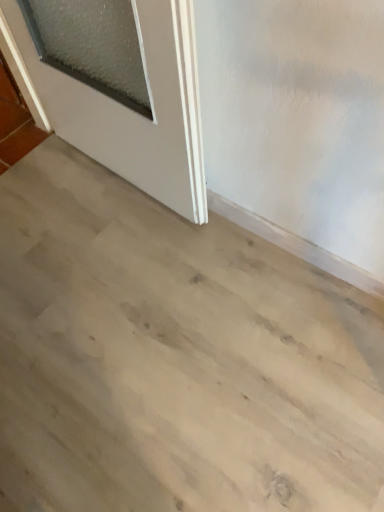
At what (x,y) coordinates should I click in order to perform the action: click on white glossy door at upper left. Please return your answer as a coordinate pair (x, y). The image size is (384, 512). Looking at the image, I should click on (133, 111).

Measure the distance between point (153,86) and camera.

Point (153,86) and camera are 1.11 meters apart from each other.

What do you see at coordinates (133, 111) in the screenshot? I see `white glossy door at upper left` at bounding box center [133, 111].

You are a GUI agent. You are given a task and a screenshot of the screen. Output one action in this format:
    pyautogui.click(x=<x>, y=<y>)
    Task: Click on the white glossy door at upper left
    Image resolution: width=384 pixels, height=512 pixels.
    Given the screenshot: What is the action you would take?
    click(x=133, y=111)